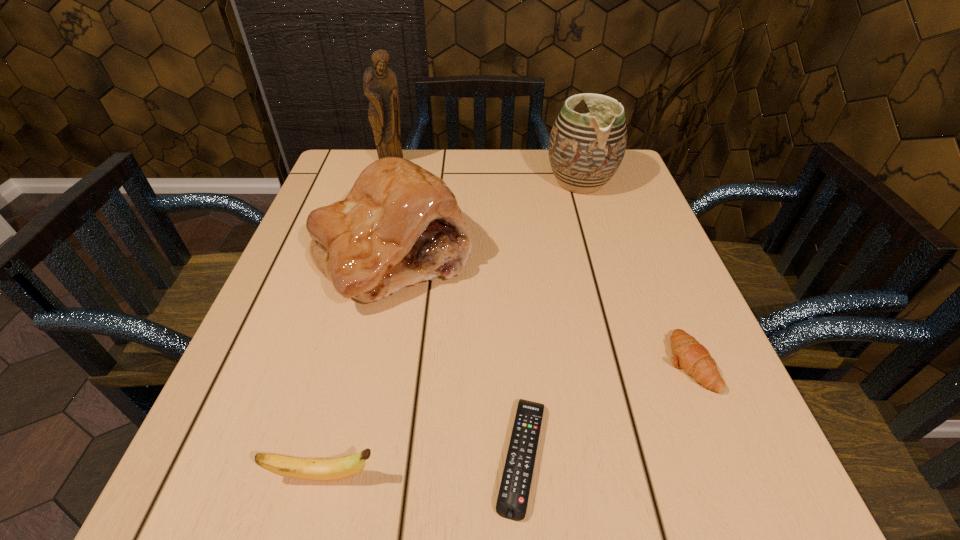
Locate an element on the screen. free spot between the pottery and the banana is located at coordinates (452, 329).

Image resolution: width=960 pixels, height=540 pixels. Find the location of `free space between the shortest object and the pottery`. free space between the shortest object and the pottery is located at coordinates (551, 319).

Identify the location of unoccupied position between the figurine and the second shortest object. The image size is (960, 540). (540, 263).

Select which object appears as the third closest to the crescent roll. Please provide its 2D coordinates. Your answer should be formatted as a tuple, i.e. [(x, y)], where the tuple contains the x and y coordinates of a point satisfying the conditions above.

[(585, 150)]

Select which object is the fourth closest to the crescent roll. Please provide its 2D coordinates. Your answer should be formatted as a tuple, i.e. [(x, y)], where the tuple contains the x and y coordinates of a point satisfying the conditions above.

[(332, 469)]

I want to click on free point that satisfies the following two spatial constraints: 1. on the filling side of the bread; 2. at the stem of the banana, so click(346, 476).

The width and height of the screenshot is (960, 540). Find the location of `free space that satisfies the following two spatial constraints: 1. on the front-facing side of the figurine; 2. on the right side of the remote control`. free space that satisfies the following two spatial constraints: 1. on the front-facing side of the figurine; 2. on the right side of the remote control is located at coordinates (311, 456).